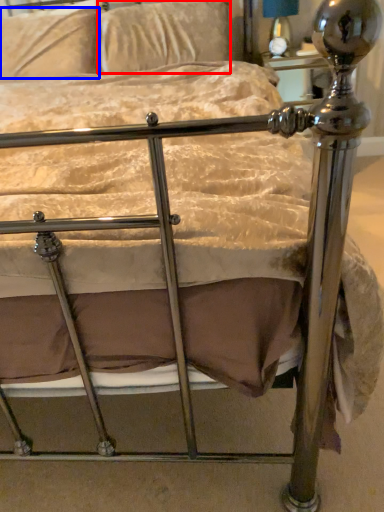
Question: Among these objects, which one is farthest to the camera, pillow (highlighted by a red box) or pillow (highlighted by a blue box)?

Choices:
 (A) pillow
 (B) pillow

Answer: (B)